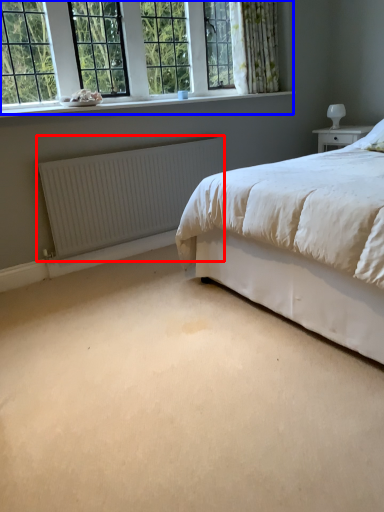
Question: Which point is closer to the camera, radiator (highlighted by a red box) or window (highlighted by a blue box)?

Choices:
 (A) radiator
 (B) window

Answer: (B)